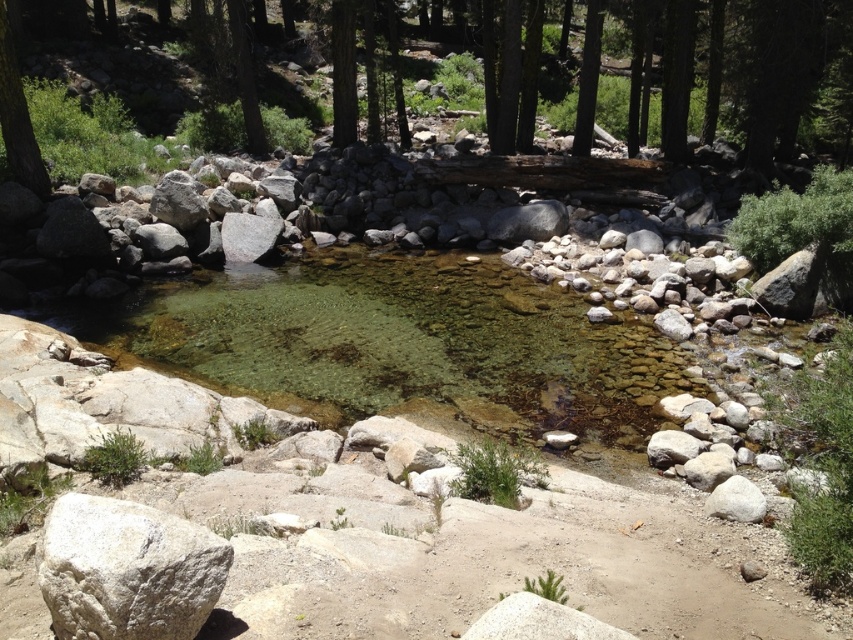
Who is lower down, white rough boulder at lower left or smooth bark tree at left?

white rough boulder at lower left is below.

Where is `white rough boulder at lower left`? The height and width of the screenshot is (640, 853). white rough boulder at lower left is located at coordinates (126, 570).